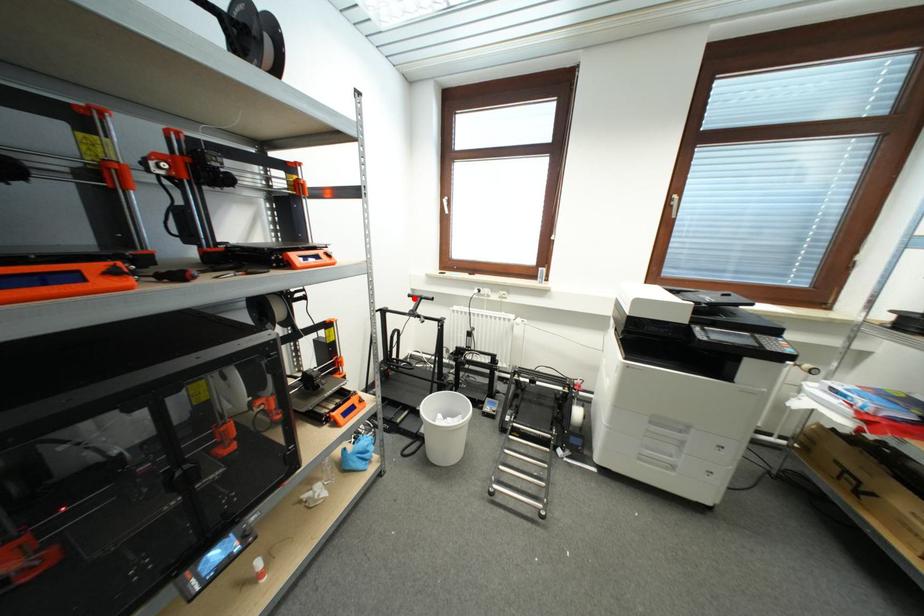
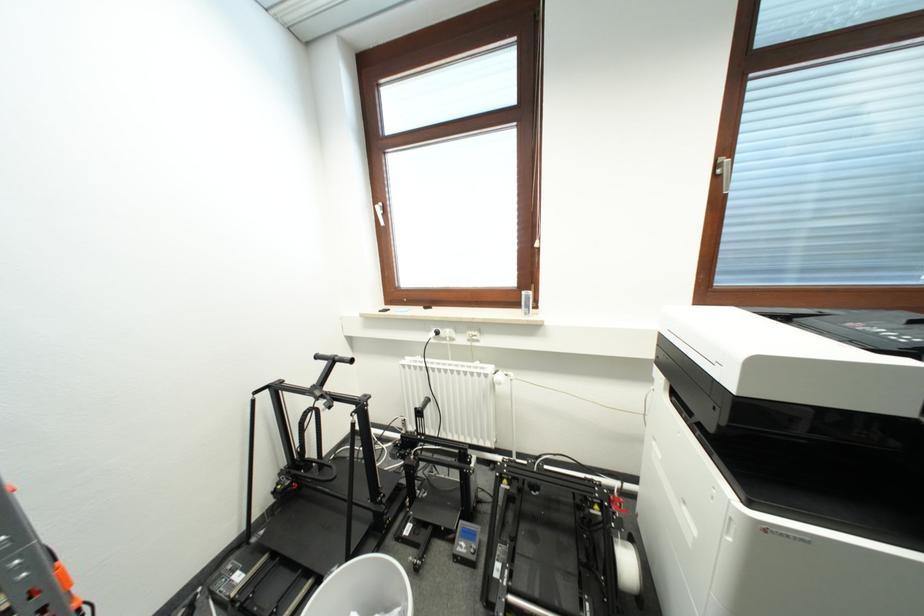
The point at the highlighted location is marked in the first image. Where is the corresponding point in the second image?

(322, 360)